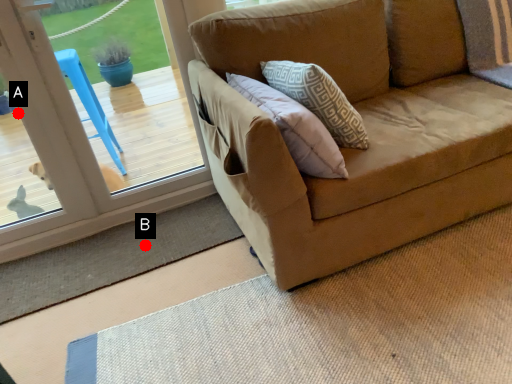
Question: Two points are circled on the image, labeled by A and B beside each circle. Among these points, which one is farthest from the camera?

Choices:
 (A) A is further
 (B) B is further

Answer: (B)